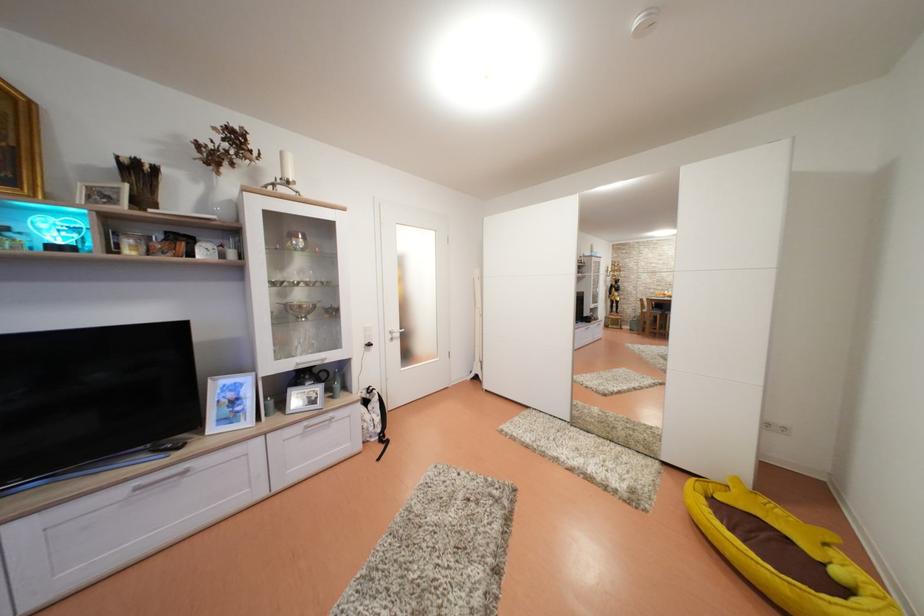
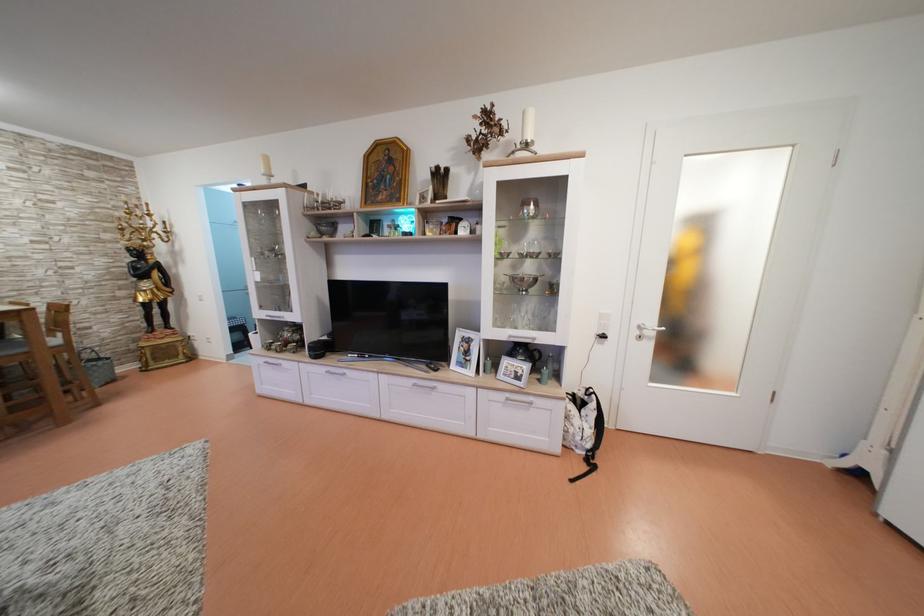
The point at (312, 429) is marked in the first image. Where is the corresponding point in the second image?

(515, 400)